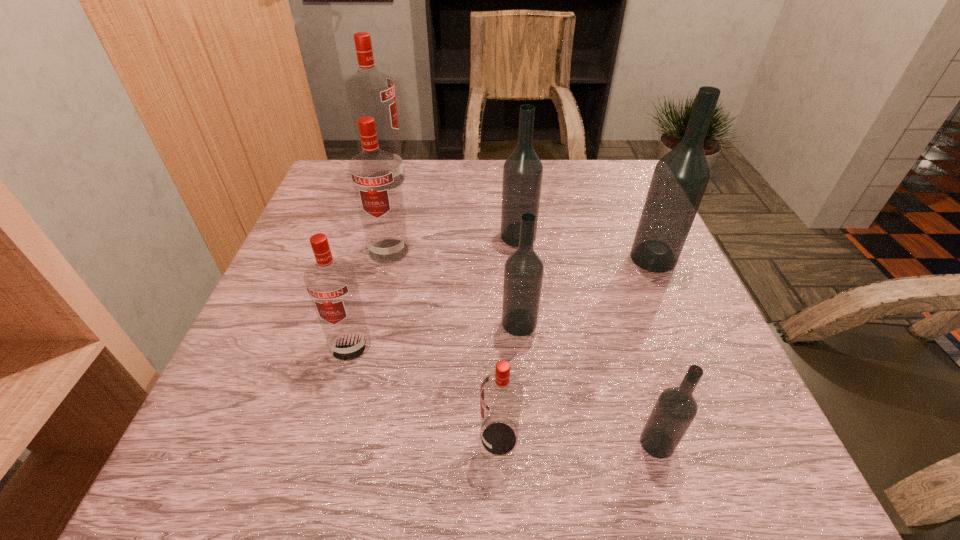
This screenshot has width=960, height=540. I want to click on the second vodka from right to left, so click(675, 409).

Locate an element on the screen. The width and height of the screenshot is (960, 540). the second object from right to left is located at coordinates (675, 409).

At what (x,y) coordinates should I click in order to perform the action: click on vacant region located on the front label of the biggest red vodka. Please return your answer as a coordinate pair (x, y). The image size is (960, 540). Looking at the image, I should click on (436, 180).

Identify the location of blank space located on the back of the biggest black vodka. (632, 208).

Identify the location of vacant space located 0.320m on the left of the second biggest black vodka. This screenshot has height=540, width=960. (361, 236).

I want to click on free space located on the front label of the third nearest red vodka, so click(373, 314).

You are a GUI agent. You are given a task and a screenshot of the screen. Output one action in this format:
    pyautogui.click(x=<x>, y=<y>)
    Task: Click on the free point located 0.140m on the back of the third farthest black vodka
    The height and width of the screenshot is (540, 960).
    Given the screenshot: What is the action you would take?
    pyautogui.click(x=514, y=262)

At what (x,y) coordinates should I click in order to perform the action: click on vacant region located 0.180m on the front label of the third farthest red vodka. Please return your answer as a coordinate pair (x, y). The image size is (960, 540). Looking at the image, I should click on (318, 467).

Image resolution: width=960 pixels, height=540 pixels. Identify the location of vacant area situated 0.070m on the front label of the nearest red vodka. (433, 438).

Locate an element on the screen. The height and width of the screenshot is (540, 960). vacant space situated 0.210m on the front label of the nearest red vodka is located at coordinates (338, 438).